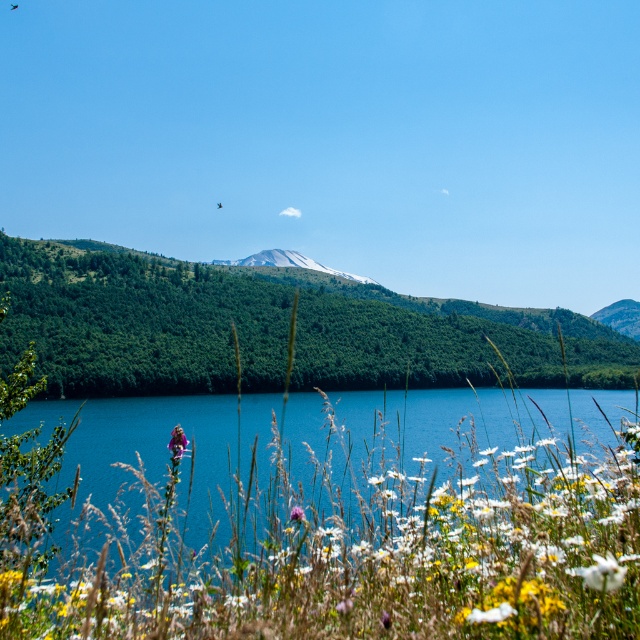
You are standing at the water edge looking towards the mountain. Which object, the snowy rock mountain at center or the smooth gray rock at upper right, is closer to you?

The snowy rock mountain at center is closer to you because it is positioned over the smooth gray rock at upper right, meaning it is in front of it from your perspective.

You are standing at the edge of the blue water at center and looking towards the snowy rock mountain at center. Which object is closer to you?

The blue water at center is closer to you because it is positioned under the snowy rock mountain at center.